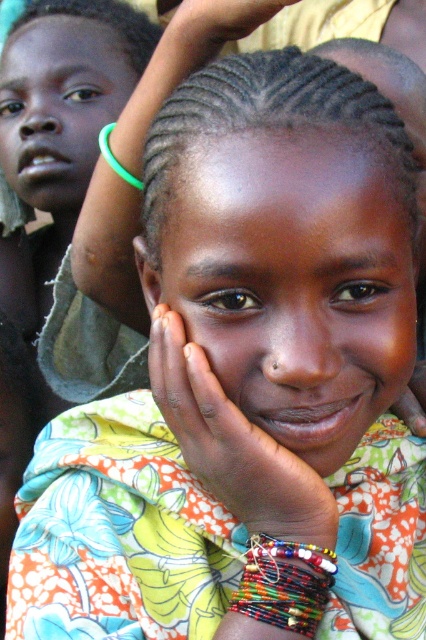
Based on the photo, can you confirm if matte floral dress at center is positioned to the right of green rubber bracelet at center?

Yes, matte floral dress at center is to the right of green rubber bracelet at center.

Is point (235, 369) in front of point (109, 157)?

Yes.

Image resolution: width=426 pixels, height=640 pixels. Identify the location of matte floral dress at center. (293, 280).

Does beaded multicolored bracelet at lower center have a lesser width compared to green rubber bracelet at center?

No, beaded multicolored bracelet at lower center is not thinner than green rubber bracelet at center.

Measure the distance between beaded multicolored bracelet at lower center and camera.

beaded multicolored bracelet at lower center is 22.20 inches from camera.

Identify the location of beaded multicolored bracelet at lower center. The image size is (426, 640). (284, 582).

Can you confirm if matte floral dress at center is wider than beaded multicolored bracelet at lower center?

Correct, the width of matte floral dress at center exceeds that of beaded multicolored bracelet at lower center.

Identify the location of matte floral dress at center. The image size is (426, 640). (293, 280).